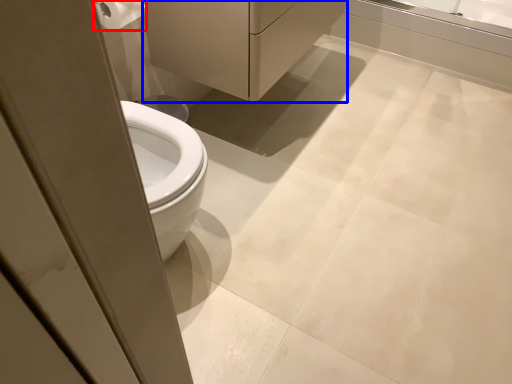
Question: Among these objects, which one is nearest to the camera, toilet paper (highlighted by a red box) or porcelain (highlighted by a blue box)?

Choices:
 (A) toilet paper
 (B) porcelain

Answer: (A)